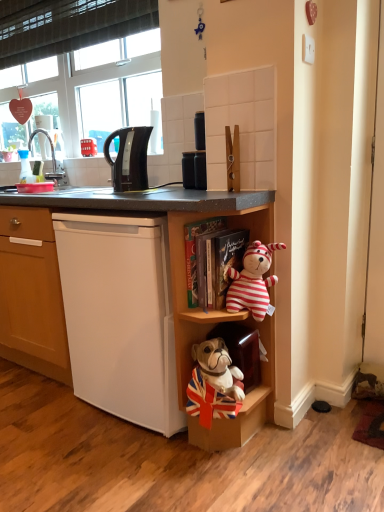
Question: Is velvet-like brown cabinet at lower center, the second cabinet positioned from the left, at the back of brushed metal faucet at upper left?

Choices:
 (A) no
 (B) yes

Answer: (A)

Question: Can velvet-like brown cabinet at lower center, which ranks as the 1th cabinet in right-to-left order, be found inside brushed metal faucet at upper left?

Choices:
 (A) no
 (B) yes

Answer: (A)

Question: Is brushed metal faucet at upper left to the right of velvet-like brown cabinet at lower center, the second cabinet positioned from the left, from the viewer's perspective?

Choices:
 (A) yes
 (B) no

Answer: (B)

Question: Does brushed metal faucet at upper left have a lesser width compared to velvet-like brown cabinet at lower center, which ranks as the 1th cabinet in right-to-left order?

Choices:
 (A) no
 (B) yes

Answer: (B)

Question: Does brushed metal faucet at upper left appear on the left side of velvet-like brown cabinet at lower center, which ranks as the 1th cabinet in right-to-left order?

Choices:
 (A) no
 (B) yes

Answer: (B)

Question: Does point (29, 166) appear closer or farther from the camera than point (89, 154)?

Choices:
 (A) closer
 (B) farther

Answer: (A)

Question: From a real-world perspective, is transparent plastic bottle at left positioned above or below red plastic phone at upper left?

Choices:
 (A) below
 (B) above

Answer: (A)

Question: From the image's perspective, is transparent plastic bottle at left positioned above or below red plastic phone at upper left?

Choices:
 (A) below
 (B) above

Answer: (A)

Question: Is transparent plastic bottle at left inside or outside of red plastic phone at upper left?

Choices:
 (A) inside
 (B) outside

Answer: (B)

Question: Looking at their shapes, would you say striped fabric teddy bear at center, which appears as the 1th shelf when viewed from the top, is wider or thinner than transparent plastic bottle at left?

Choices:
 (A) wide
 (B) thin

Answer: (A)

Question: From the image's perspective, is striped fabric teddy bear at center, placed as the 2th shelf when sorted from bottom to top, positioned above or below transparent plastic bottle at left?

Choices:
 (A) above
 (B) below

Answer: (B)

Question: Considering the positions of point pyautogui.click(x=175, y=310) and point pyautogui.click(x=29, y=174), is point pyautogui.click(x=175, y=310) closer or farther from the camera than point pyautogui.click(x=29, y=174)?

Choices:
 (A) farther
 (B) closer

Answer: (B)

Question: Looking at the image, does striped fabric teddy bear at center, which appears as the 1th shelf when viewed from the top, seem bigger or smaller compared to transparent plastic bottle at left?

Choices:
 (A) big
 (B) small

Answer: (A)

Question: From the image's perspective, is red plastic phone at upper left above or below matte black canister at upper center?

Choices:
 (A) below
 (B) above

Answer: (B)

Question: Would you say red plastic phone at upper left is inside or outside matte black canister at upper center?

Choices:
 (A) outside
 (B) inside

Answer: (A)